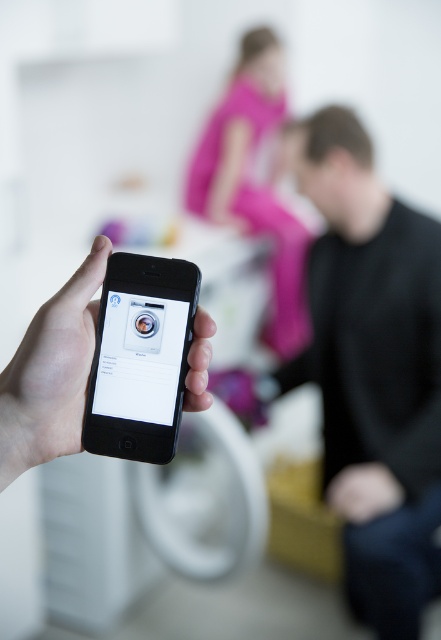
Question: Which point is farther to the camera?

Choices:
 (A) white glossy washing machine at center
 (B) black matte phone at center
 (C) black matte shirt at right
 (D) pink fabric pants at upper center

Answer: (D)

Question: Which is nearer to the black matte shirt at right?

Choices:
 (A) white glossy washing machine at center
 (B) black matte phone at center

Answer: (B)

Question: Is black matte phone at center to the right of white glossy washing machine at center from the viewer's perspective?

Choices:
 (A) yes
 (B) no

Answer: (B)

Question: Among these points, which one is nearest to the camera?

Choices:
 (A) (123, 336)
 (B) (280, 300)
 (C) (205, 336)

Answer: (C)

Question: Does black matte shirt at right appear over white glossy washing machine at center?

Choices:
 (A) yes
 (B) no

Answer: (B)

Question: Can you confirm if black matte phone at center is positioned to the right of white glossy washing machine at center?

Choices:
 (A) yes
 (B) no

Answer: (B)